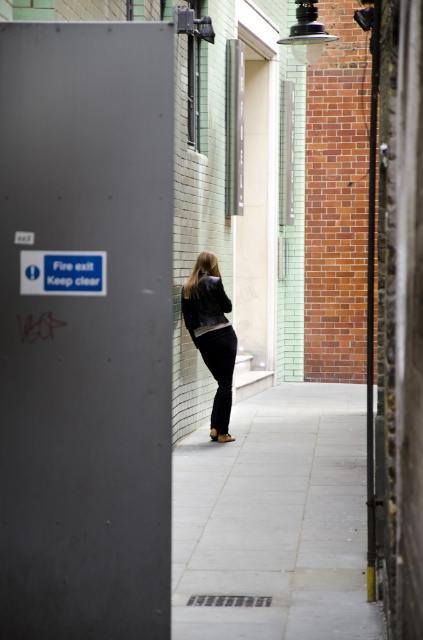
You are a delivery robot in an urban alleyway. You need to place a package on the gray concrete pavement at center. What are the coordinates where you should place the package?

The gray concrete pavement at center is located at coordinates point (275, 518), so place the package there.

You are a drone operator trying to navigate through the narrow alleyway. You have two points marked in the scene, point (x=233, y=448) and point (x=219, y=282). Which point should you aim for if you want to fly closer to the camera?

Point (x=233, y=448) is further to the camera than point (x=219, y=282), so you should aim for point (x=233, y=448) to fly closer to the camera.

Consider the image. You are a delivery person who needs to place a small package on the ground in the alleyway. Given the gray concrete pavement at center and the matte black jacket at center, which object is shorter and thus suitable for placing the package?

The gray concrete pavement at center is not as tall as the matte black jacket at center, so the gray concrete pavement at center is shorter and suitable for placing the package.